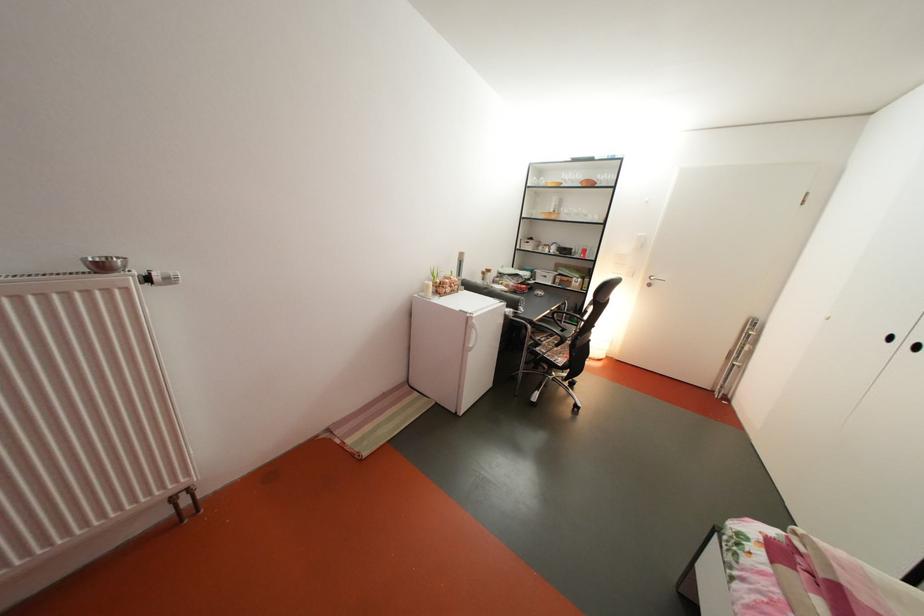
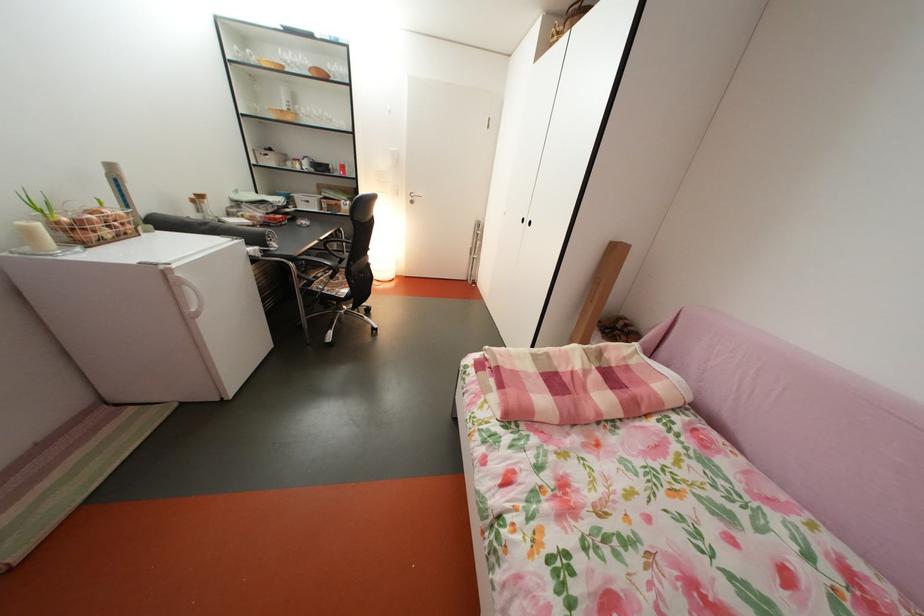
Locate, in the second image, the point that corresponds to point 439,293 in the first image.

(41, 238)